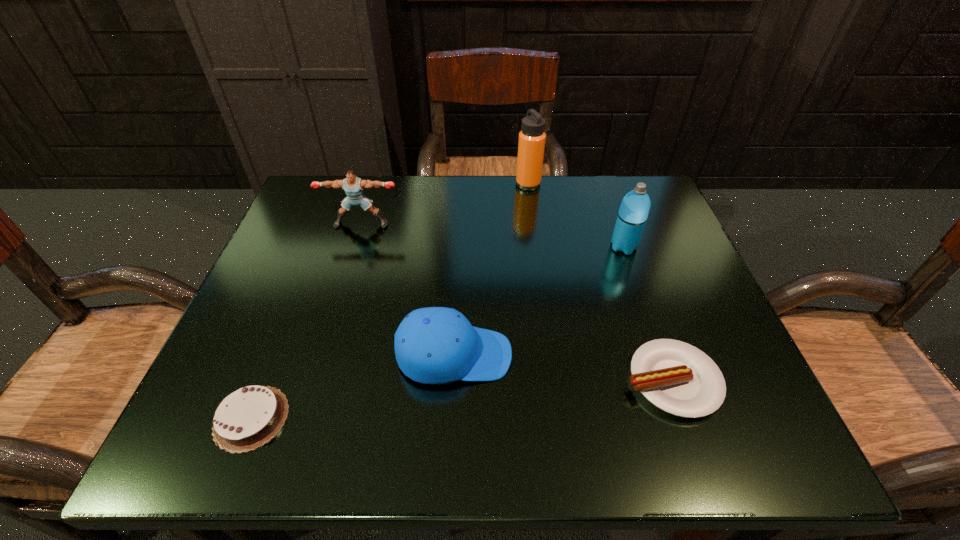
The width and height of the screenshot is (960, 540). I want to click on the tallest object, so click(531, 144).

At what (x,y) coordinates should I click in order to perform the action: click on the farthest object. Please return your answer as a coordinate pair (x, y). Looking at the image, I should click on (531, 144).

This screenshot has height=540, width=960. In order to click on the shorter thermos bottle in this screenshot , I will do `click(633, 213)`.

Locate an element on the screen. The height and width of the screenshot is (540, 960). the right thermos bottle is located at coordinates (633, 213).

Identify the location of the third tallest object. This screenshot has height=540, width=960. pyautogui.click(x=353, y=186).

Where is `the second farthest object`? the second farthest object is located at coordinates (353, 186).

Where is `cap`? cap is located at coordinates (434, 345).

The height and width of the screenshot is (540, 960). Identify the location of the third shortest object. (434, 345).

Find the location of a particular element. This screenshot has height=540, width=960. the fifth tallest object is located at coordinates (680, 379).

Locate an element on the screen. This screenshot has height=540, width=960. the shortest object is located at coordinates (246, 419).